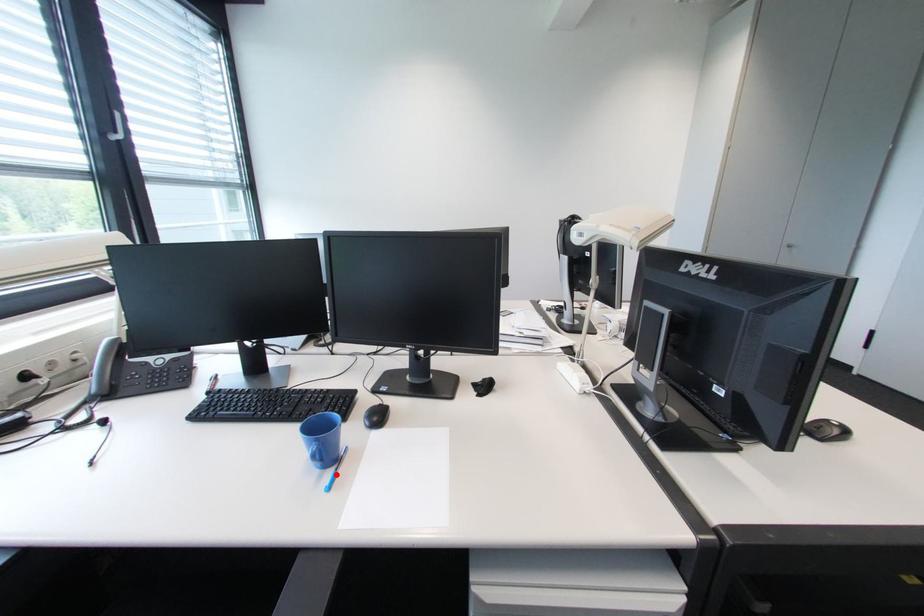
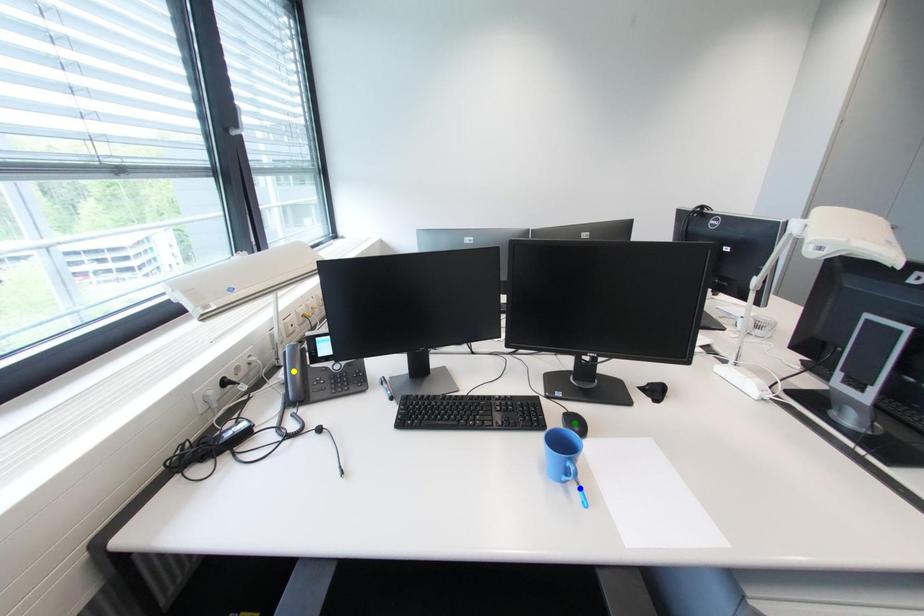
Question: I am providing you with two images of the same scene from different viewpoints. A red point is marked on the first image. You are given multiple points on the second image. Which point in image 2 is actually the same real-world point as the red point in image 1?

Choices:
 (A) yellow point
 (B) green point
 (C) blue point

Answer: (C)